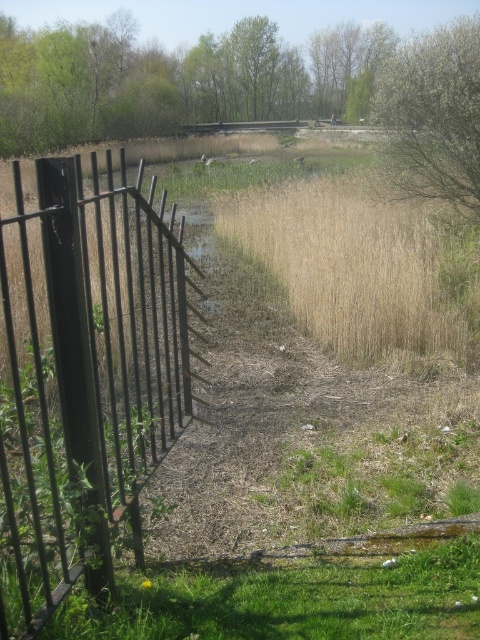
You are standing at the point marked by the coordinates point (84, 376) in the image. What object are you currently standing on?

The point (84, 376) corresponds to the black metal fence at left, so you are standing on the black metal fence at left.

You are a gardener planning to paint the black metal fence at left and the green leafy tree at upper right. If you have enough paint for one object, which one should you choose based on their sizes?

The black metal fence at left is wider than the green leafy tree at upper right, so you should choose to paint the black metal fence at left first since it requires more paint.

You are a hiker who wants to take a photo of the green leafy tree at upper right without the black metal fence at left blocking the view. Based on their positions, is this possible?

The black metal fence at left is located below the green leafy tree at upper right, so the fence is lower in position. Since the tree is above the fence, you can position yourself so that the fence does not block the view of the tree.